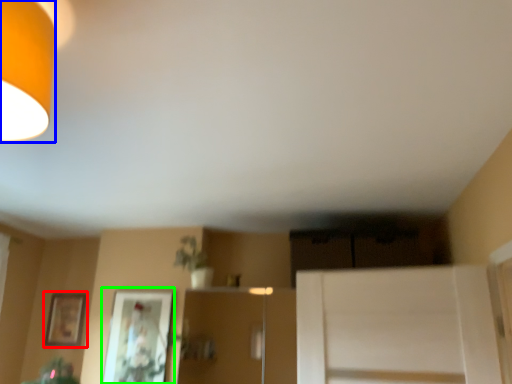
Question: Considering the real-world distances, which object is closest to picture frame (highlighted by a red box)? lamp (highlighted by a blue box) or picture frame (highlighted by a green box).

Choices:
 (A) lamp
 (B) picture frame

Answer: (B)